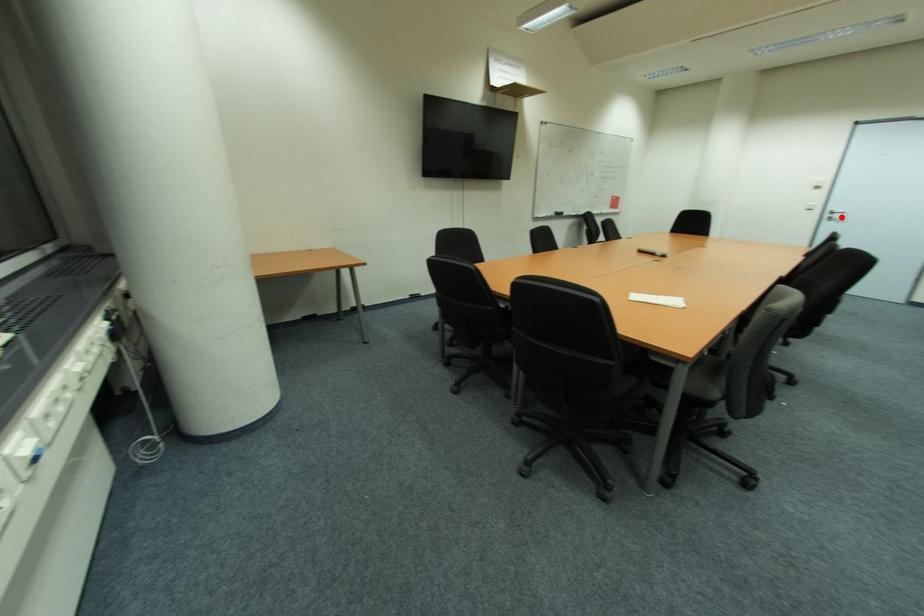
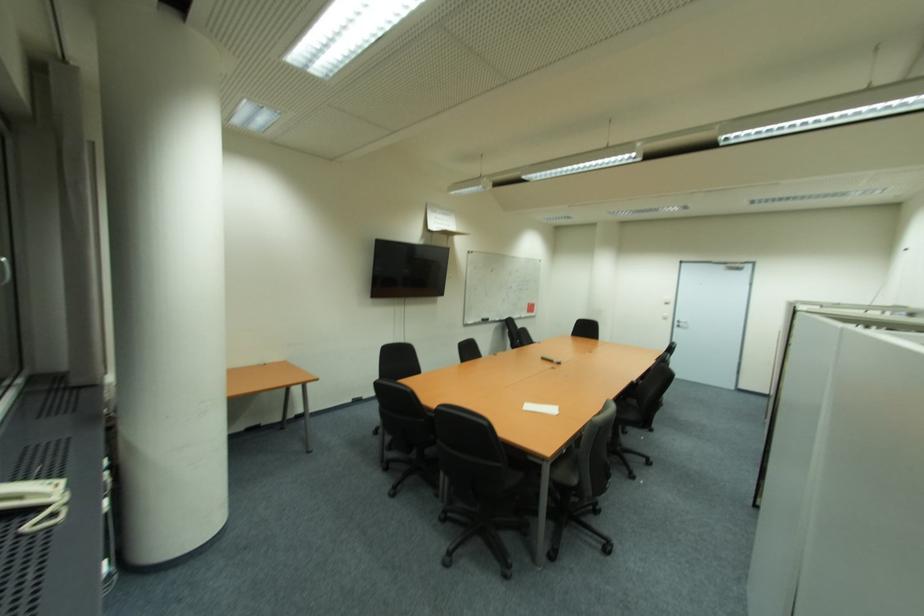
In the second image, find the point that corresponds to the highlighted location in the first image.

(686, 325)